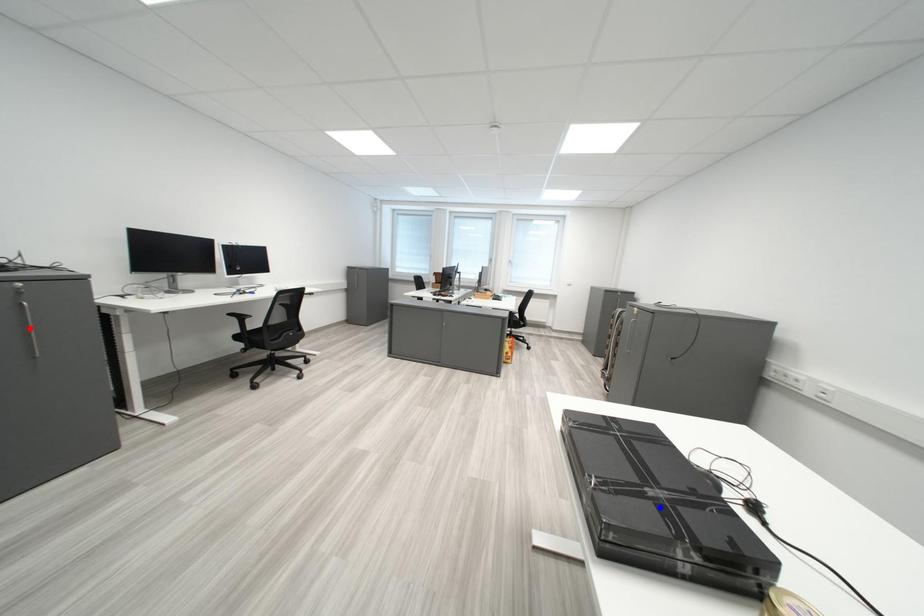
Question: Which of the two points in the image is closer to the camera?

Choices:
 (A) Blue point is closer.
 (B) Red point is closer.

Answer: (A)